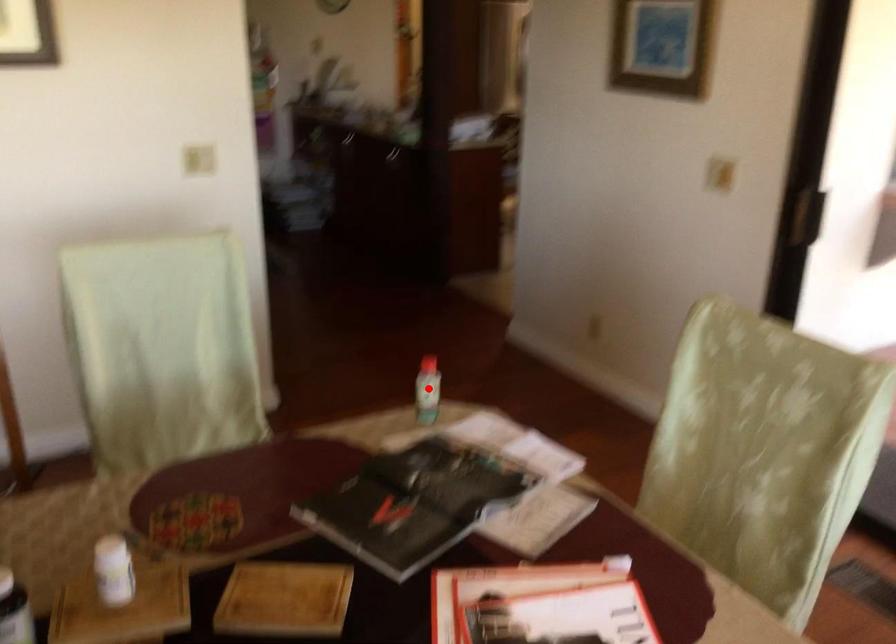
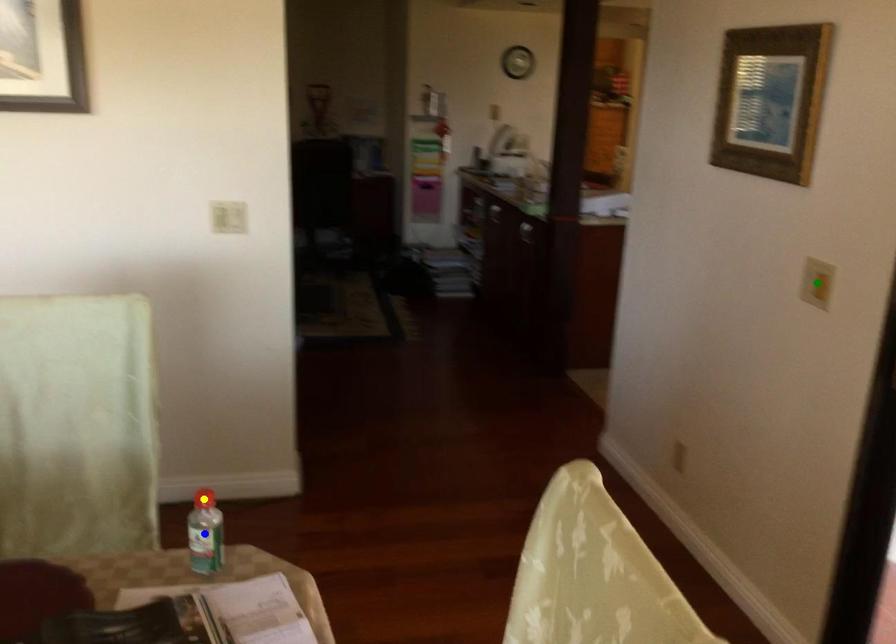
Question: I am providing you with two images of the same scene from different viewpoints. A red point is marked on the first image. You are given multiple points on the second image. Which spot in image 2 lines up with the point in image 1?

Choices:
 (A) blue point
 (B) green point
 (C) yellow point

Answer: (A)